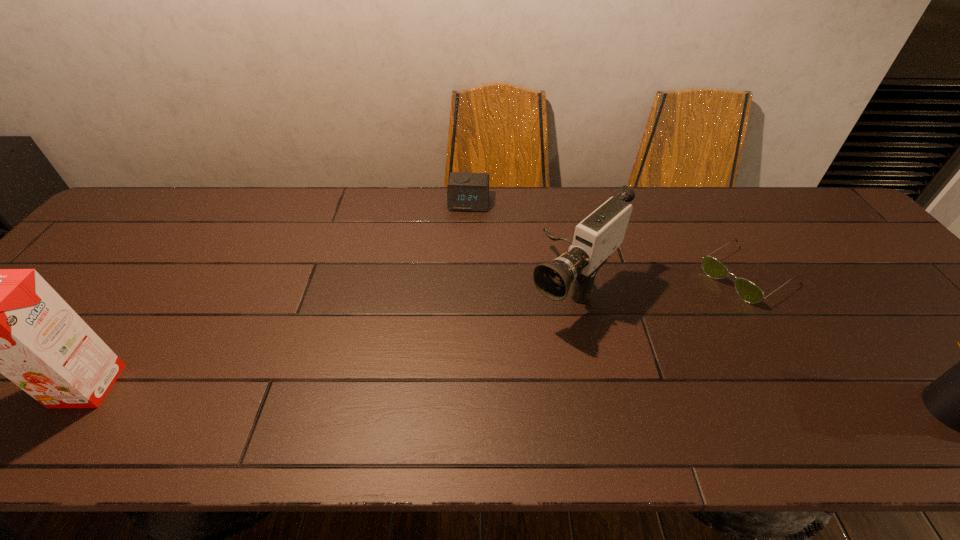
The width and height of the screenshot is (960, 540). Identify the location of vacant space on the desktop that is between the tallest object and the rightmost object and is positioned on the front-facing side of the shortest object. (558, 398).

Locate an element on the screen. vacant space on the desktop that is between the tallest object and the rightmost object and is positioned on the recording direction of the camcorder is located at coordinates (461, 395).

Where is `free space on the desktop that is between the tallest object and the third shortest object and is positioned on the front-facing side of the alarm clock`? The width and height of the screenshot is (960, 540). free space on the desktop that is between the tallest object and the third shortest object and is positioned on the front-facing side of the alarm clock is located at coordinates (444, 395).